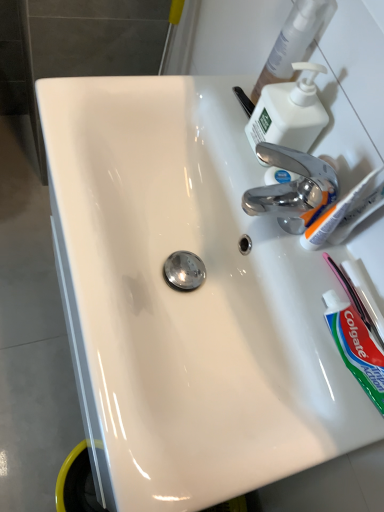
What is the approximate width of pink plastic toothbrush at lower right, which is the first toothbrush from bottom to top?

pink plastic toothbrush at lower right, which is the first toothbrush from bottom to top, is 1.31 centimeters wide.

The height and width of the screenshot is (512, 384). What do you see at coordinates (289, 112) in the screenshot? I see `white plastic soap dispenser at upper right` at bounding box center [289, 112].

Identify the location of white plastic toothbrush at upper right, which is counted as the 2th toothbrush, starting from the bottom. The height and width of the screenshot is (512, 384). pos(333,216).

What are the coordinates of `pink plastic toothbrush at lower right, which appears as the 2th toothbrush when viewed from the left` in the screenshot? It's located at (359, 296).

In the scene shown: Between white plastic toothbrush at upper right, which is counted as the 2th toothbrush, starting from the bottom, and green matte toothpaste at lower right, which one has smaller width?

Thinner between the two is white plastic toothbrush at upper right, which is counted as the 2th toothbrush, starting from the bottom.

Can you tell me how much white plastic toothbrush at upper right, positioned as the 1th toothbrush in top-to-bottom order, and green matte toothpaste at lower right differ in facing direction?

The angle between the facing direction of white plastic toothbrush at upper right, positioned as the 1th toothbrush in top-to-bottom order, and the facing direction of green matte toothpaste at lower right is 4.16 degrees.

Find the location of a particular element. The height and width of the screenshot is (512, 384). toothpaste located on the right of white plastic toothbrush at upper right, positioned as the 1th toothbrush in top-to-bottom order is located at coordinates (356, 347).

How far apart are white plastic toothbrush at upper right, positioned as the 1th toothbrush in top-to-bottom order, and green matte toothpaste at lower right?

white plastic toothbrush at upper right, positioned as the 1th toothbrush in top-to-bottom order, and green matte toothpaste at lower right are 4.98 inches apart from each other.

Which is behind, pink plastic toothbrush at lower right, which is the first toothbrush from bottom to top, or white plastic toothbrush at upper right, positioned as the 1th toothbrush in top-to-bottom order?

pink plastic toothbrush at lower right, which is the first toothbrush from bottom to top, is more distant.

Which object is positioned more to the left, pink plastic toothbrush at lower right, which ranks as the 1th toothbrush in right-to-left order, or white plastic toothbrush at upper right, the 1th toothbrush positioned from the left?

white plastic toothbrush at upper right, the 1th toothbrush positioned from the left.

Is pink plastic toothbrush at lower right, the second toothbrush when ordered from top to bottom, positioned with its back to white plastic toothbrush at upper right, the 1th toothbrush positioned from the left?

pink plastic toothbrush at lower right, the second toothbrush when ordered from top to bottom, does not have its back to white plastic toothbrush at upper right, the 1th toothbrush positioned from the left.

Are pink plastic toothbrush at lower right, which ranks as the 1th toothbrush in right-to-left order, and white plastic toothbrush at upper right, the 1th toothbrush positioned from the left, far apart?

No, there isn't a large distance between pink plastic toothbrush at lower right, which ranks as the 1th toothbrush in right-to-left order, and white plastic toothbrush at upper right, the 1th toothbrush positioned from the left.

Could you tell me if white plastic toothbrush at upper right, positioned as the 1th toothbrush in top-to-bottom order, is turned towards white plastic soap dispenser at upper right?

No, white plastic toothbrush at upper right, positioned as the 1th toothbrush in top-to-bottom order, is not facing towards white plastic soap dispenser at upper right.

Is point (357, 194) in front of point (287, 126)?

Yes, it is in front of point (287, 126).

Is white plastic toothbrush at upper right, the 2th toothbrush positioned from the right, far away from white plastic soap dispenser at upper right?

That's not correct — white plastic toothbrush at upper right, the 2th toothbrush positioned from the right, is a little close to white plastic soap dispenser at upper right.

From the image's perspective, which one is positioned lower, white plastic toothbrush at upper right, which is counted as the 2th toothbrush, starting from the bottom, or white plastic soap dispenser at upper right?

white plastic toothbrush at upper right, which is counted as the 2th toothbrush, starting from the bottom.

Which is behind, point (264, 109) or point (383, 407)?

The point (264, 109) is behind.

From a real-world perspective, is white plastic soap dispenser at upper right under green matte toothpaste at lower right?

No, from a real-world perspective, white plastic soap dispenser at upper right is not below green matte toothpaste at lower right.

You are a GUI agent. You are given a task and a screenshot of the screen. Output one action in this format:
    pyautogui.click(x=<x>, y=<y>)
    Task: Click on the soap dispenser that is above the green matte toothpaste at lower right (from the image's perspective)
    The height and width of the screenshot is (512, 384).
    Given the screenshot: What is the action you would take?
    pyautogui.click(x=289, y=112)

Would you consider green matte toothpaste at lower right to be distant from pink plastic toothbrush at lower right, which appears as the 2th toothbrush when viewed from the left?

They are positioned close to each other.

Is green matte toothpaste at lower right looking in the opposite direction of pink plastic toothbrush at lower right, which is the first toothbrush from bottom to top?

That's right, green matte toothpaste at lower right is facing away from pink plastic toothbrush at lower right, which is the first toothbrush from bottom to top.

Is green matte toothpaste at lower right to the left of pink plastic toothbrush at lower right, which ranks as the 1th toothbrush in right-to-left order, from the viewer's perspective?

Indeed, green matte toothpaste at lower right is positioned on the left side of pink plastic toothbrush at lower right, which ranks as the 1th toothbrush in right-to-left order.

Which of these two, green matte toothpaste at lower right or pink plastic toothbrush at lower right, which appears as the 2th toothbrush when viewed from the left, stands shorter?

With less height is pink plastic toothbrush at lower right, which appears as the 2th toothbrush when viewed from the left.

How much distance is there between green matte toothpaste at lower right and white plastic soap dispenser at upper right?

green matte toothpaste at lower right is 10.94 inches from white plastic soap dispenser at upper right.

From the image's perspective, does green matte toothpaste at lower right appear lower than white plastic soap dispenser at upper right?

Correct, green matte toothpaste at lower right appears lower than white plastic soap dispenser at upper right in the image.

What's the angular difference between green matte toothpaste at lower right and white plastic soap dispenser at upper right's facing directions?

The facing directions of green matte toothpaste at lower right and white plastic soap dispenser at upper right are 9.57 degrees apart.

Between green matte toothpaste at lower right and white plastic soap dispenser at upper right, which one has smaller width?

Thinner between the two is green matte toothpaste at lower right.

Is white plastic soap dispenser at upper right oriented away from white plastic toothbrush at upper right, which is counted as the 2th toothbrush, starting from the bottom?

No.

Is white plastic soap dispenser at upper right to the right of white plastic toothbrush at upper right, positioned as the 1th toothbrush in top-to-bottom order, from the viewer's perspective?

No.

From the image's perspective, is white plastic soap dispenser at upper right positioned above or below white plastic toothbrush at upper right, positioned as the 1th toothbrush in top-to-bottom order?

white plastic soap dispenser at upper right is situated higher than white plastic toothbrush at upper right, positioned as the 1th toothbrush in top-to-bottom order, in the image.

Considering the sizes of white plastic soap dispenser at upper right and white plastic toothbrush at upper right, which is counted as the 2th toothbrush, starting from the bottom, in the image, is white plastic soap dispenser at upper right taller or shorter than white plastic toothbrush at upper right, which is counted as the 2th toothbrush, starting from the bottom,?

white plastic soap dispenser at upper right is shorter than white plastic toothbrush at upper right, which is counted as the 2th toothbrush, starting from the bottom.

I want to click on toothpaste located below the white plastic toothbrush at upper right, the 1th toothbrush positioned from the left (from the image's perspective), so coord(356,347).

The height and width of the screenshot is (512, 384). Identify the location of toothbrush that is in front of the pink plastic toothbrush at lower right, which is the first toothbrush from bottom to top. (333, 216).

When comparing their distances from white plastic soap dispenser at upper right, does white plastic toothbrush at upper right, the 2th toothbrush positioned from the right, or pink plastic toothbrush at lower right, which appears as the 2th toothbrush when viewed from the left, seem closer?

white plastic toothbrush at upper right, the 2th toothbrush positioned from the right, is closer to white plastic soap dispenser at upper right.

Looking at the image, which one is located further to white plastic soap dispenser at upper right, green matte toothpaste at lower right or white plastic toothbrush at upper right, the 1th toothbrush positioned from the left?

Based on the image, green matte toothpaste at lower right appears to be further to white plastic soap dispenser at upper right.

From the image, which object appears to be farther from white plastic soap dispenser at upper right, pink plastic toothbrush at lower right, which appears as the 2th toothbrush when viewed from the left, or white plastic toothbrush at upper right, the 1th toothbrush positioned from the left?

pink plastic toothbrush at lower right, which appears as the 2th toothbrush when viewed from the left.

From the image, which object appears to be nearer to pink plastic toothbrush at lower right, the second toothbrush when ordered from top to bottom, white plastic toothbrush at upper right, which is counted as the 2th toothbrush, starting from the bottom, or green matte toothpaste at lower right?

green matte toothpaste at lower right lies closer to pink plastic toothbrush at lower right, the second toothbrush when ordered from top to bottom, than the other object.

Which object lies further to the anchor point green matte toothpaste at lower right, white plastic toothbrush at upper right, which is counted as the 2th toothbrush, starting from the bottom, or pink plastic toothbrush at lower right, the second toothbrush when ordered from top to bottom?

white plastic toothbrush at upper right, which is counted as the 2th toothbrush, starting from the bottom, is further to green matte toothpaste at lower right.

Looking at the image, which one is located closer to white plastic soap dispenser at upper right, pink plastic toothbrush at lower right, the second toothbrush when ordered from top to bottom, or green matte toothpaste at lower right?

pink plastic toothbrush at lower right, the second toothbrush when ordered from top to bottom, is positioned closer to the anchor white plastic soap dispenser at upper right.

Estimate the real-world distances between objects in this image. Which object is closer to white plastic toothbrush at upper right, positioned as the 1th toothbrush in top-to-bottom order, white plastic soap dispenser at upper right or green matte toothpaste at lower right?

green matte toothpaste at lower right is closer to white plastic toothbrush at upper right, positioned as the 1th toothbrush in top-to-bottom order.

In the scene shown: When comparing their distances from white plastic toothbrush at upper right, which is counted as the 2th toothbrush, starting from the bottom, does white plastic soap dispenser at upper right or pink plastic toothbrush at lower right, which ranks as the 1th toothbrush in right-to-left order, seem closer?

pink plastic toothbrush at lower right, which ranks as the 1th toothbrush in right-to-left order, is closer to white plastic toothbrush at upper right, which is counted as the 2th toothbrush, starting from the bottom.

Find the location of `toothbrush between white plastic toothbrush at upper right, which is counted as the 2th toothbrush, starting from the bottom, and green matte toothpaste at lower right from top to bottom`. toothbrush between white plastic toothbrush at upper right, which is counted as the 2th toothbrush, starting from the bottom, and green matte toothpaste at lower right from top to bottom is located at coordinates (359, 296).

In order to click on toothbrush between white plastic soap dispenser at upper right and pink plastic toothbrush at lower right, which is the first toothbrush from bottom to top, vertically in this screenshot , I will do (333, 216).